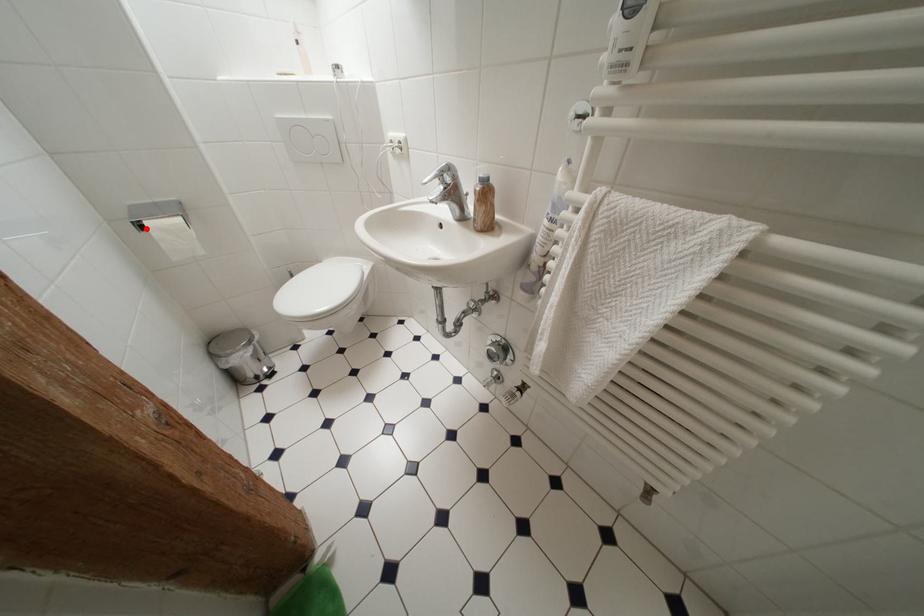
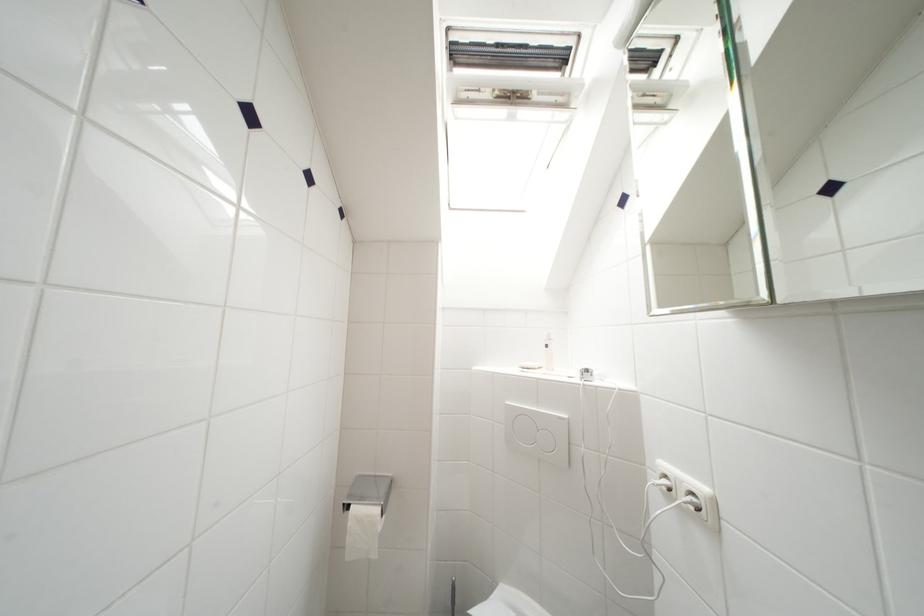
Find the pixel in the second image that matches the highlighted location in the first image.

(354, 512)